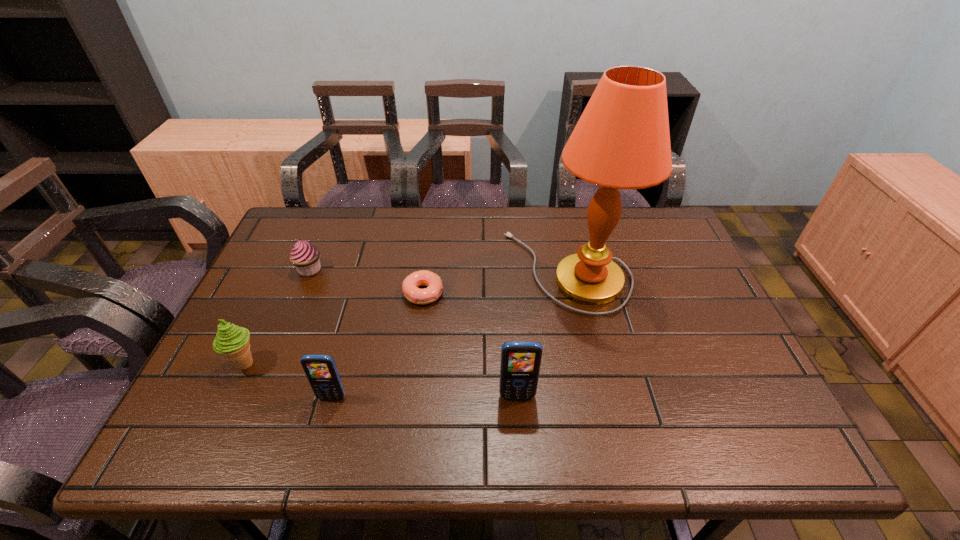
Where is `vacant place for an extra cellular telephone on the right`? The image size is (960, 540). vacant place for an extra cellular telephone on the right is located at coordinates (702, 395).